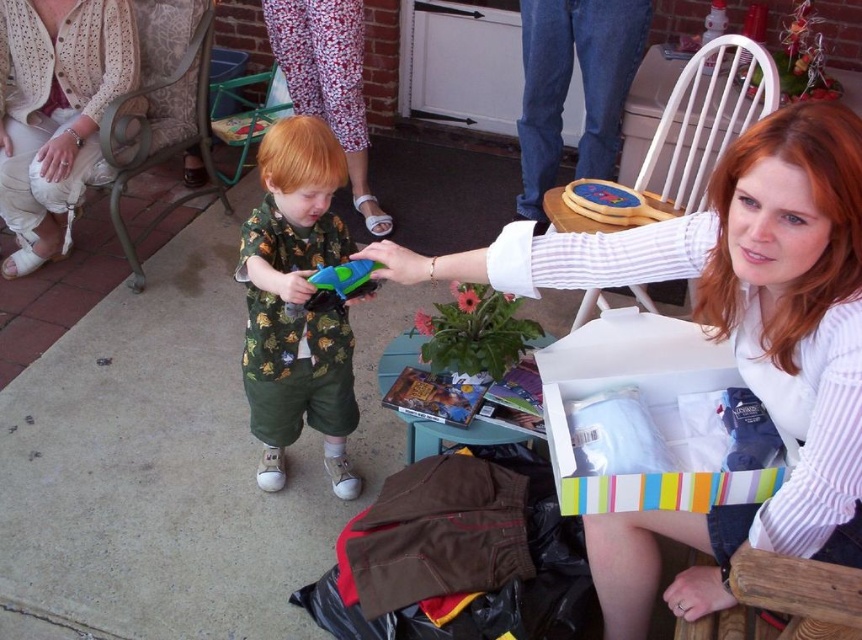
Can you confirm if white striped shirt at upper right is positioned to the right of white crochet cardigan at upper left?

Correct, you'll find white striped shirt at upper right to the right of white crochet cardigan at upper left.

Does white striped shirt at upper right appear over white crochet cardigan at upper left?

Actually, white striped shirt at upper right is below white crochet cardigan at upper left.

Where is `white striped shirt at upper right`? The height and width of the screenshot is (640, 862). white striped shirt at upper right is located at coordinates (728, 337).

Image resolution: width=862 pixels, height=640 pixels. I want to click on printed fabric shirt at center, so click(x=297, y=305).

Can you confirm if printed fabric shirt at center is taller than metallic fabric chair at upper left?

Incorrect, printed fabric shirt at center's height is not larger of metallic fabric chair at upper left's.

Is point (317, 220) positioned after point (155, 72)?

No, it is in front of (155, 72).

At what (x,y) coordinates should I click in order to perform the action: click on printed fabric shirt at center. Please return your answer as a coordinate pair (x, y). This screenshot has height=640, width=862. Looking at the image, I should click on (297, 305).

This screenshot has height=640, width=862. Describe the element at coordinates (161, 109) in the screenshot. I see `metallic fabric chair at upper left` at that location.

Who is more distant from viewer, (177, 112) or (807, 582)?

The point (177, 112) is more distant.

Locate an element on the screen. metallic fabric chair at upper left is located at coordinates (161, 109).